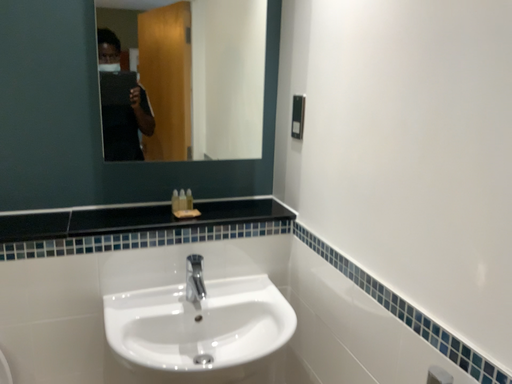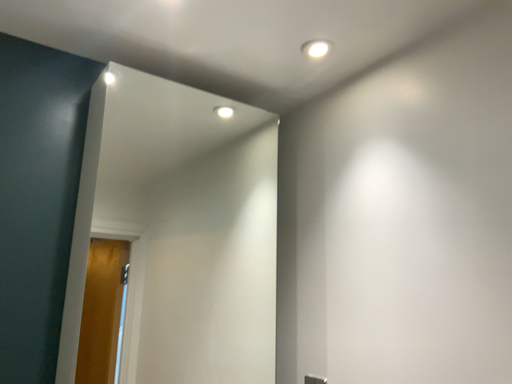
Question: Which way did the camera rotate in the video?

Choices:
 (A) rotated upward
 (B) rotated downward

Answer: (A)